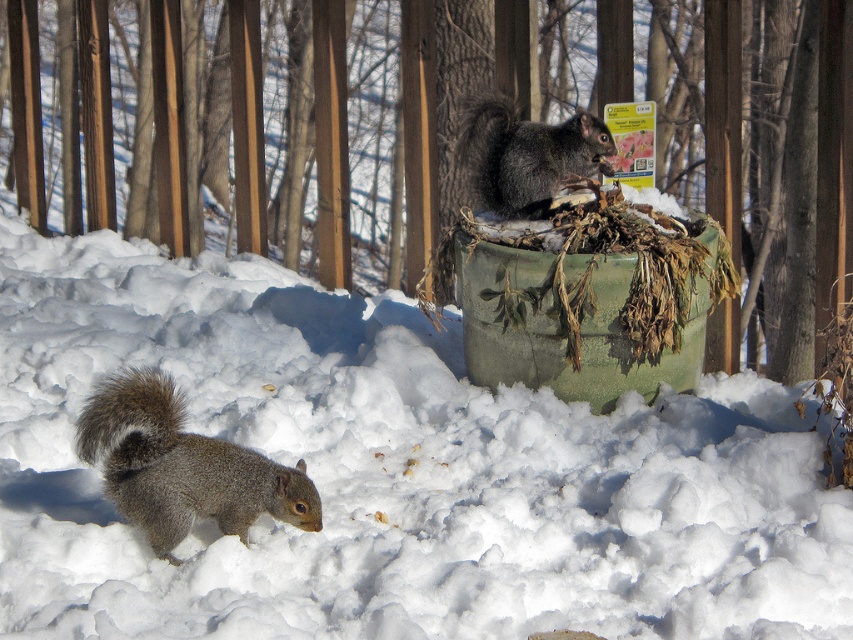
Question: Can you confirm if gray furry squirrel at lower left is wider than shiny black squirrel at center?

Choices:
 (A) yes
 (B) no

Answer: (A)

Question: Is white fluffy snow at lower center further to camera compared to gray furry squirrel at lower left?

Choices:
 (A) yes
 (B) no

Answer: (B)

Question: Which of the following is the closest to the observer?

Choices:
 (A) shiny black squirrel at center
 (B) gray furry squirrel at lower left

Answer: (B)

Question: Is white fluffy snow at lower center above shiny black squirrel at center?

Choices:
 (A) yes
 (B) no

Answer: (B)

Question: Which point is farther to the camera?

Choices:
 (A) gray furry squirrel at lower left
 (B) white fluffy snow at lower center

Answer: (A)

Question: Considering the real-world distances, which object is farthest from the shiny black squirrel at center?

Choices:
 (A) gray furry squirrel at lower left
 (B) white fluffy snow at lower center

Answer: (A)